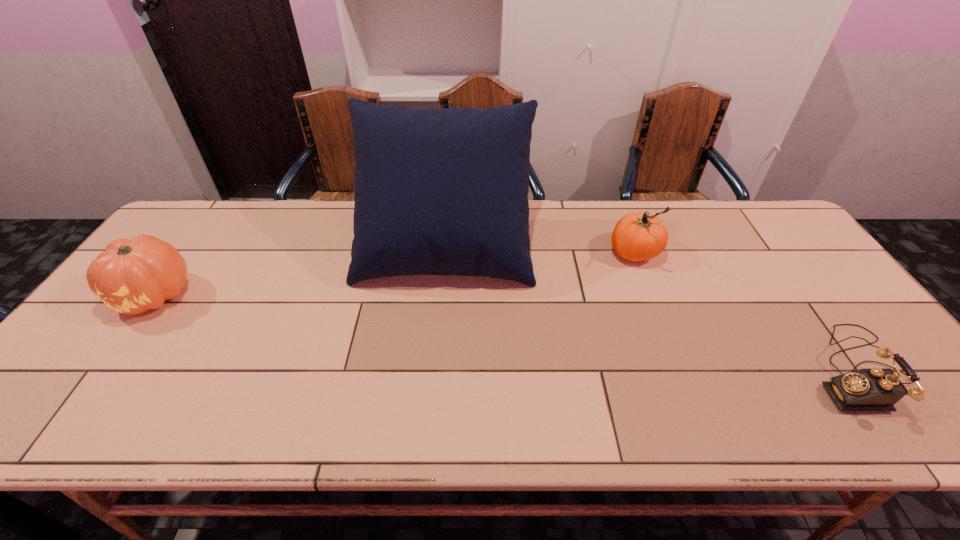
Identify the location of unoccupied area between the telephone and the cushion. (651, 308).

Identify which object is located as the nearest to the third shortest object. Please provide its 2D coordinates. Your answer should be formatted as a tuple, i.e. [(x, y)], where the tuple contains the x and y coordinates of a point satisfying the conditions above.

[(440, 191)]

Locate which object ranks second in proximity to the third object from left to right. Please provide its 2D coordinates. Your answer should be formatted as a tuple, i.e. [(x, y)], where the tuple contains the x and y coordinates of a point satisfying the conditions above.

[(875, 389)]

At what (x,y) coordinates should I click in order to perform the action: click on vacant area that satisfies the following two spatial constraints: 1. on the facing side of the third object from right to left; 2. on the left side of the second object from right to left. Please return your answer as a coordinate pair (x, y). Looking at the image, I should click on (444, 253).

This screenshot has height=540, width=960. What are the coordinates of `free location that satisfies the following two spatial constraints: 1. on the facing side of the third shortest object; 2. on the left side of the cushion` in the screenshot? It's located at (444, 253).

The width and height of the screenshot is (960, 540). In order to click on free location that satisfies the following two spatial constraints: 1. on the facing side of the taller pumpkin; 2. on the left side of the tallest object in this screenshot , I will do `click(444, 253)`.